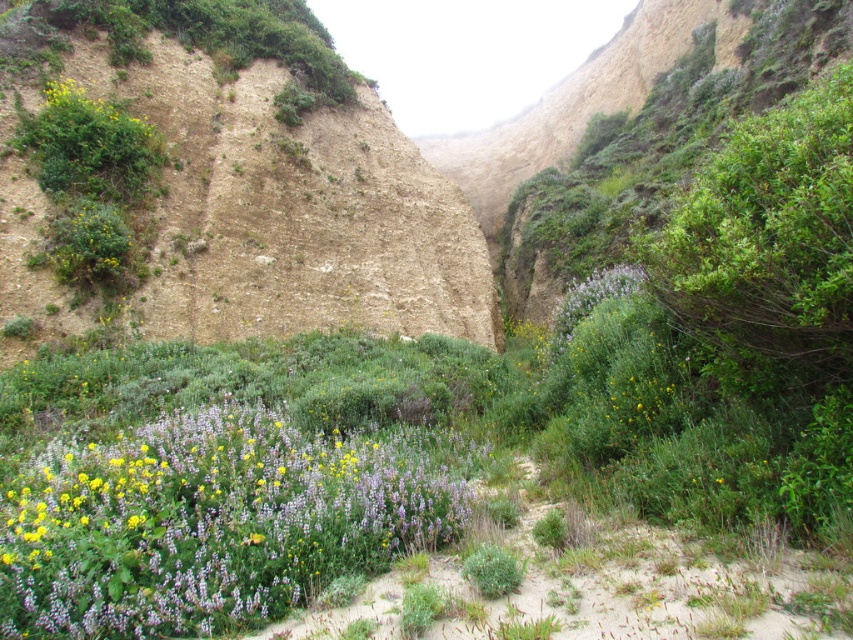
Does purple matte flowers at center have a greater height compared to yellow matte flower at upper left?

Incorrect, purple matte flowers at center's height is not larger of yellow matte flower at upper left's.

Who is shorter, purple matte flowers at center or yellow matte flower at upper left?

purple matte flowers at center is shorter.

Between point (148, 509) and point (70, 112), which one is positioned behind?

Positioned behind is point (70, 112).

The image size is (853, 640). I want to click on purple matte flowers at center, so click(x=213, y=522).